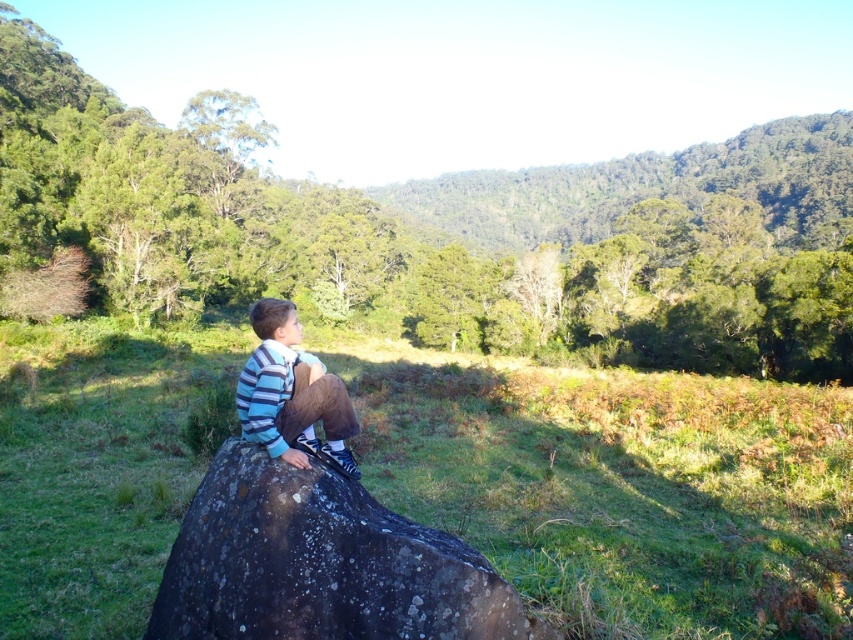
Can you confirm if speckled dark rock at center is positioned to the left of striped cotton shirt at center?

No, speckled dark rock at center is not to the left of striped cotton shirt at center.

Which is behind, point (467, 582) or point (276, 323)?

The point (276, 323) is behind.

You are a GUI agent. You are given a task and a screenshot of the screen. Output one action in this format:
    pyautogui.click(x=<x>, y=<y>)
    Task: Click on the speckled dark rock at center
    
    Given the screenshot: What is the action you would take?
    click(318, 563)